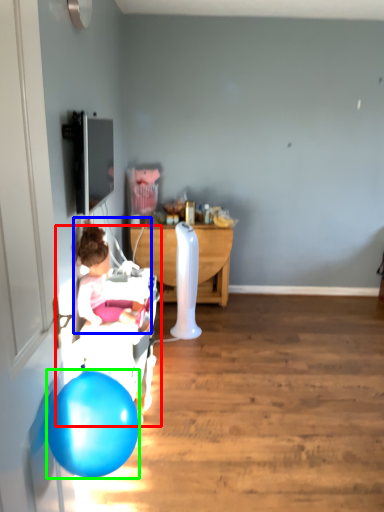
Question: Based on their relative distances, which object is farther from baby carriage (highlighted by a red box)? Choose from person (highlighted by a blue box) and balloon (highlighted by a green box).

Choices:
 (A) person
 (B) balloon

Answer: (B)